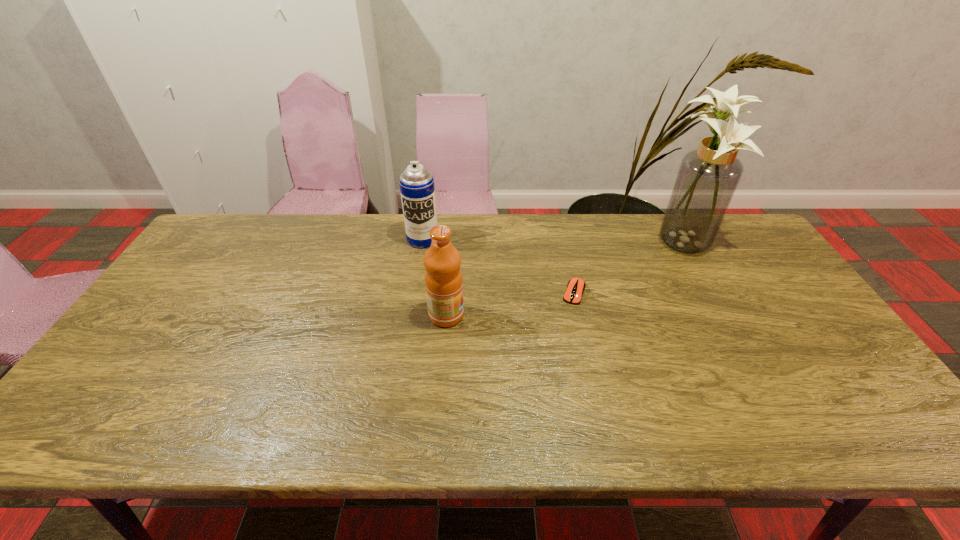
You are a GUI agent. You are given a task and a screenshot of the screen. Output one action in this format:
    pyautogui.click(x=<x>, y=<y>)
    Task: Click on the object that is the second closest one to the tallest object
    This screenshot has height=540, width=960.
    Given the screenshot: What is the action you would take?
    pyautogui.click(x=443, y=278)

The image size is (960, 540). I want to click on vacant area that satisfies the following two spatial constraints: 1. on the label side of the rightmost object; 2. on the left side of the aerosol can, so click(x=422, y=240).

The height and width of the screenshot is (540, 960). Identify the location of vacant position in the image that satisfies the following two spatial constraints: 1. on the label side of the tallest object; 2. on the right side of the aerosol can. (422, 240).